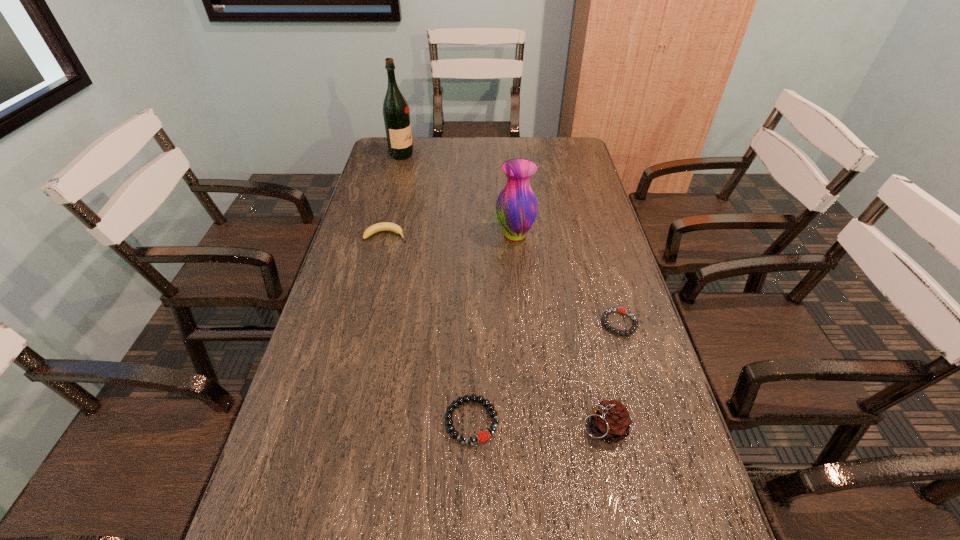
Locate an element on the screen. The image size is (960, 540). the tallest object is located at coordinates (396, 115).

Find the location of a particular element. the farthest object is located at coordinates (396, 115).

Where is `the second tallest object`? Image resolution: width=960 pixels, height=540 pixels. the second tallest object is located at coordinates (516, 209).

The width and height of the screenshot is (960, 540). Identify the location of vase. (516, 209).

This screenshot has width=960, height=540. I want to click on pinecone, so click(x=610, y=420).

Locate an element on the screen. This screenshot has height=540, width=960. the fifth object from left to right is located at coordinates (610, 420).

I want to click on the third shortest object, so click(383, 226).

Identify the location of the left bracelet. This screenshot has width=960, height=540. (482, 436).

Locate an element on the screen. the fifth tallest object is located at coordinates (482, 436).

Find the location of a particular element. the rightmost object is located at coordinates (633, 328).